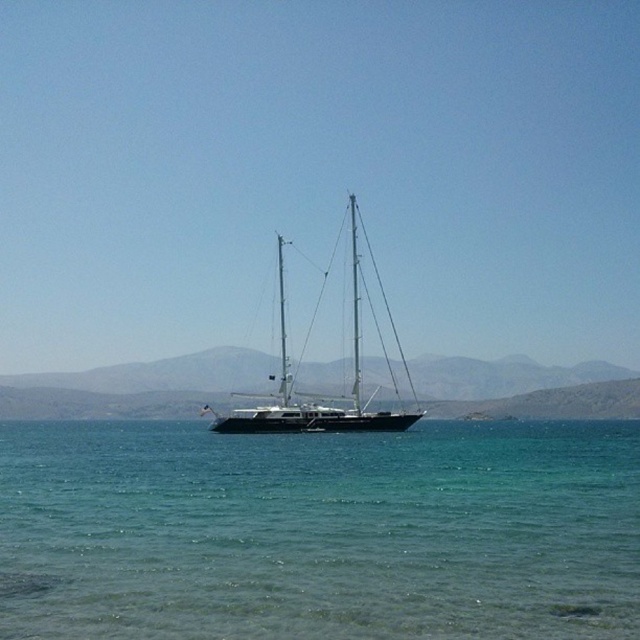
Question: Is clear water at center further to camera compared to shiny black sailboat at center?

Choices:
 (A) yes
 (B) no

Answer: (B)

Question: Among these objects, which one is farthest from the camera?

Choices:
 (A) clear water at center
 (B) shiny black sailboat at center

Answer: (B)

Question: Does clear water at center have a larger size compared to shiny black sailboat at center?

Choices:
 (A) yes
 (B) no

Answer: (B)

Question: Considering the relative positions of clear water at center and shiny black sailboat at center in the image provided, where is clear water at center located with respect to shiny black sailboat at center?

Choices:
 (A) below
 (B) above

Answer: (A)